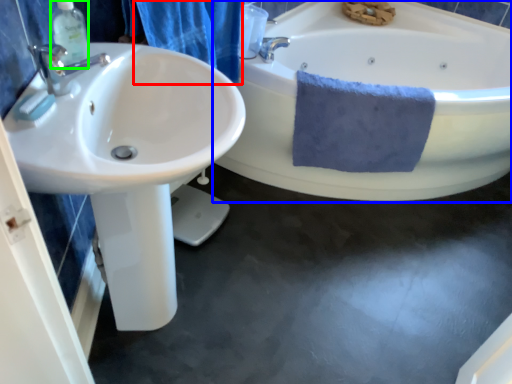
Question: Which object is positioned closest to shower curtain (highlighted by a red box)? Select from bathtub (highlighted by a blue box) and soap dispenser (highlighted by a green box).

Choices:
 (A) bathtub
 (B) soap dispenser

Answer: (B)